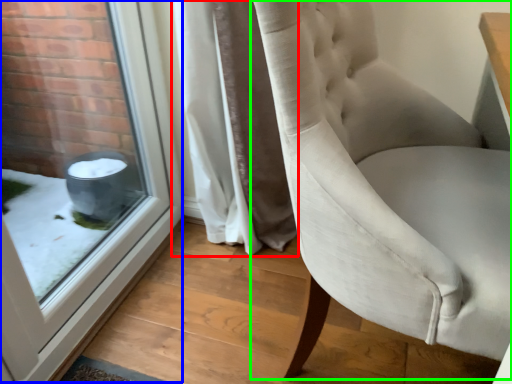
Question: Which object is positioned farthest from curtain (highlighted by a red box)? Select from window (highlighted by a blue box) and chair (highlighted by a green box).

Choices:
 (A) window
 (B) chair

Answer: (B)